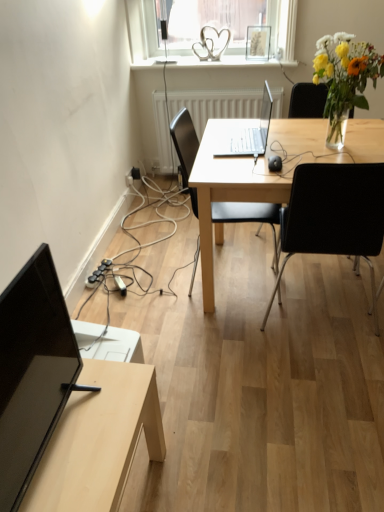
Question: From the image's perspective, is white textured radiator at center beneath light wood desk at center?

Choices:
 (A) no
 (B) yes

Answer: (A)

Question: Considering the relative positions of white textured radiator at center and light wood desk at center in the image provided, is white textured radiator at center to the right of light wood desk at center from the viewer's perspective?

Choices:
 (A) yes
 (B) no

Answer: (B)

Question: From a real-world perspective, is white textured radiator at center beneath light wood desk at center?

Choices:
 (A) no
 (B) yes

Answer: (B)

Question: Considering the relative sizes of white textured radiator at center and light wood desk at center in the image provided, is white textured radiator at center bigger than light wood desk at center?

Choices:
 (A) yes
 (B) no

Answer: (B)

Question: Can you confirm if white textured radiator at center is thinner than light wood desk at center?

Choices:
 (A) no
 (B) yes

Answer: (B)

Question: Does point (97, 276) appear closer or farther from the camera than point (170, 109)?

Choices:
 (A) closer
 (B) farther

Answer: (A)

Question: From a real-world perspective, is black rubber extension cord at lower left above or below white textured radiator at center?

Choices:
 (A) above
 (B) below

Answer: (B)

Question: From their relative heights in the image, would you say black rubber extension cord at lower left is taller or shorter than white textured radiator at center?

Choices:
 (A) short
 (B) tall

Answer: (A)

Question: Do you think black rubber extension cord at lower left is within white textured radiator at center, or outside of it?

Choices:
 (A) outside
 (B) inside

Answer: (A)

Question: From a real-world perspective, relative to light wood table at lower left, is translucent glass vase at upper right vertically above or below?

Choices:
 (A) above
 (B) below

Answer: (A)

Question: Is translucent glass vase at upper right situated inside light wood table at lower left or outside?

Choices:
 (A) outside
 (B) inside

Answer: (A)

Question: Would you say translucent glass vase at upper right is to the left or to the right of light wood table at lower left in the picture?

Choices:
 (A) left
 (B) right

Answer: (B)

Question: From the image's perspective, is translucent glass vase at upper right located above or below light wood table at lower left?

Choices:
 (A) above
 (B) below

Answer: (A)

Question: Would you say black leather chair at center, arranged as the 2th chair when viewed from the right, is to the left or to the right of black plastic chair at center, placed as the second chair when sorted from left to right, in the picture?

Choices:
 (A) left
 (B) right

Answer: (A)

Question: Considering their positions, is black leather chair at center, arranged as the 2th chair when viewed from the right, located in front of or behind black plastic chair at center, placed as the second chair when sorted from left to right?

Choices:
 (A) front
 (B) behind

Answer: (B)